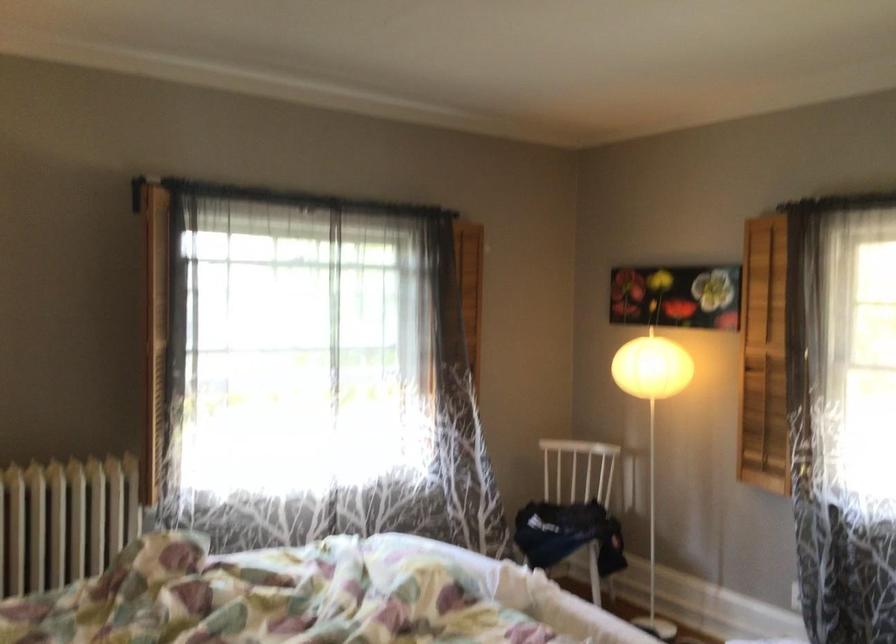
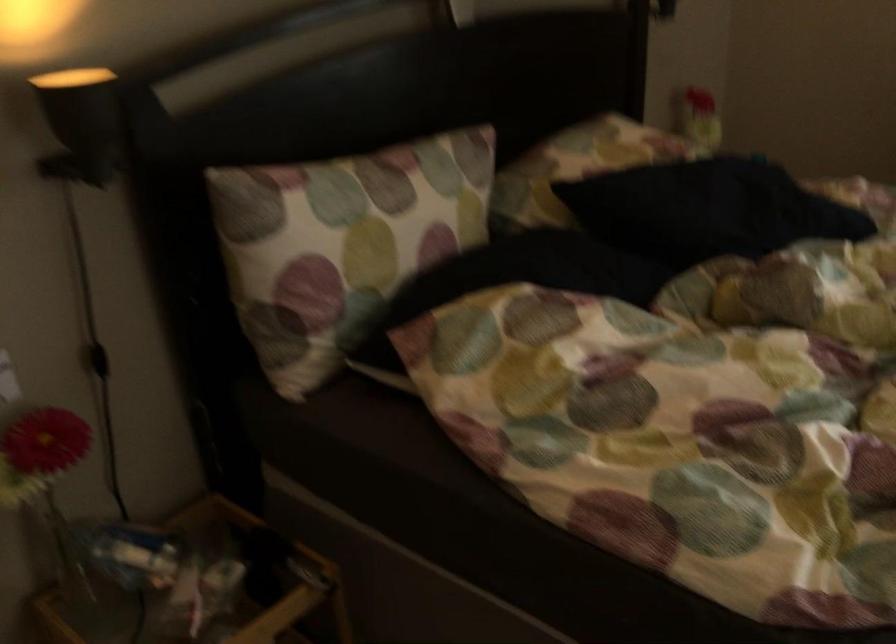
Based on the continuous images, in which direction is the camera rotating?

The camera's rotation is toward left-down.